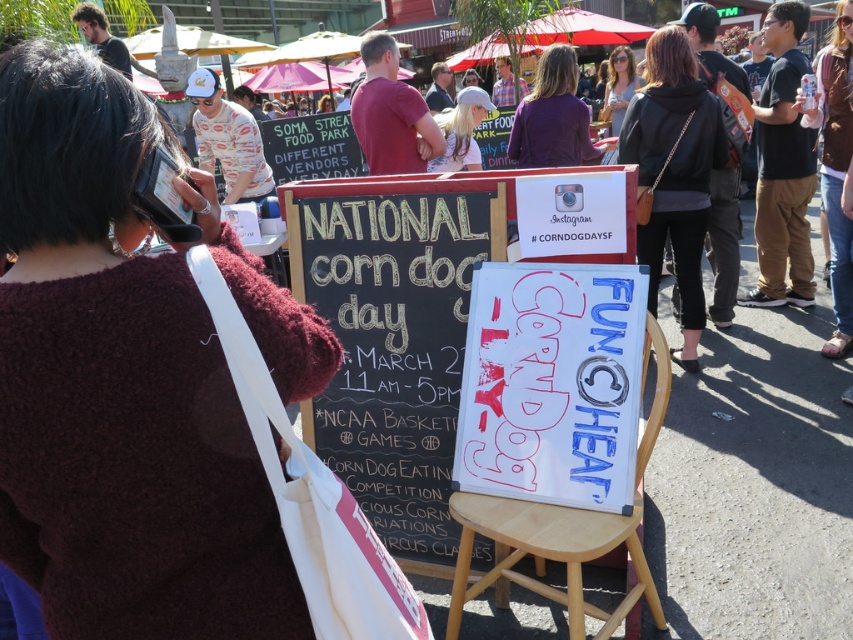
Is brown fuzzy sweater at upper left further to camera compared to purple fabric purse at upper center?

No, it is not.

What do you see at coordinates (117, 388) in the screenshot? I see `brown fuzzy sweater at upper left` at bounding box center [117, 388].

Identify the location of brown fuzzy sweater at upper left. The height and width of the screenshot is (640, 853). (117, 388).

Between point (218, 428) and point (520, 456), which one is positioned behind?

Positioned behind is point (520, 456).

The width and height of the screenshot is (853, 640). Find the location of `brown fuzzy sweater at upper left`. brown fuzzy sweater at upper left is located at coordinates (117, 388).

Who is more forward, (126, 545) or (619, 300)?

Point (126, 545) is in front.

The image size is (853, 640). Identify the location of brown fuzzy sweater at upper left. (117, 388).

Does white paper sign at center appear over light brown wooden stool at center?

Yes.

Does white paper sign at center have a larger size compared to light brown wooden stool at center?

Actually, white paper sign at center might be smaller than light brown wooden stool at center.

Between point (631, 484) and point (619, 522), which one is positioned in front?

Point (619, 522) is more forward.

Locate an element on the screen. This screenshot has height=640, width=853. white paper sign at center is located at coordinates (552, 384).